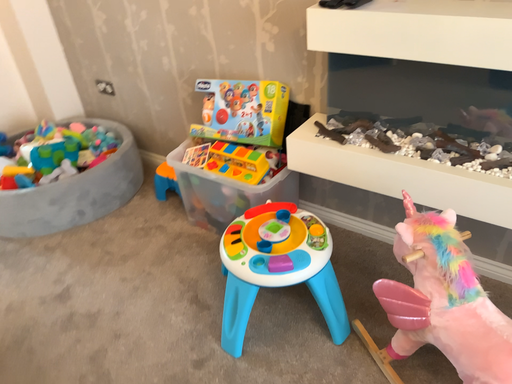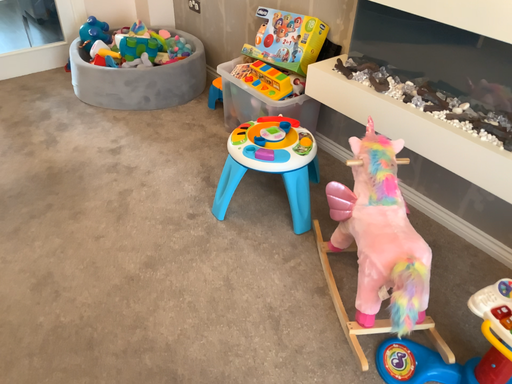
Question: How did the camera likely rotate when shooting the video?

Choices:
 (A) rotated right
 (B) rotated left

Answer: (B)